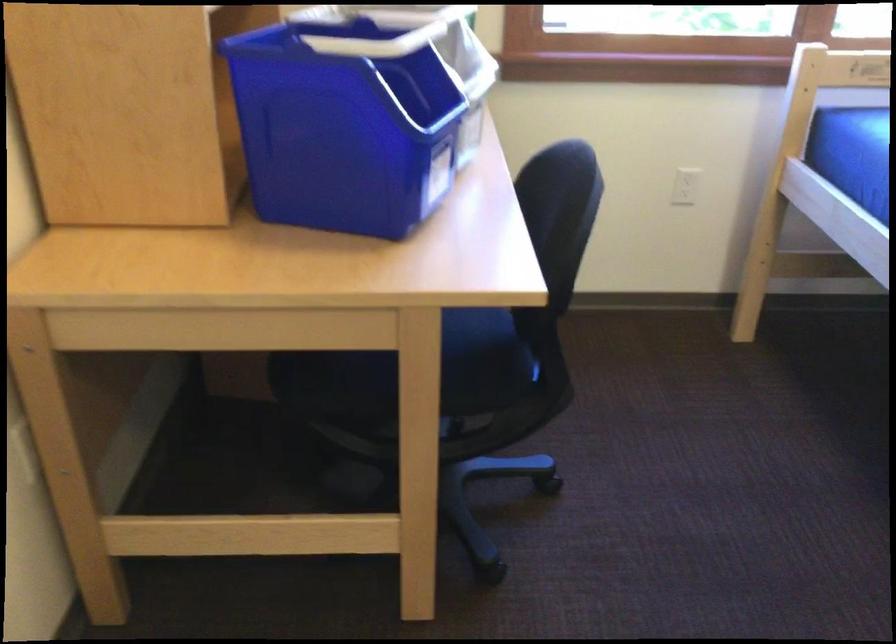
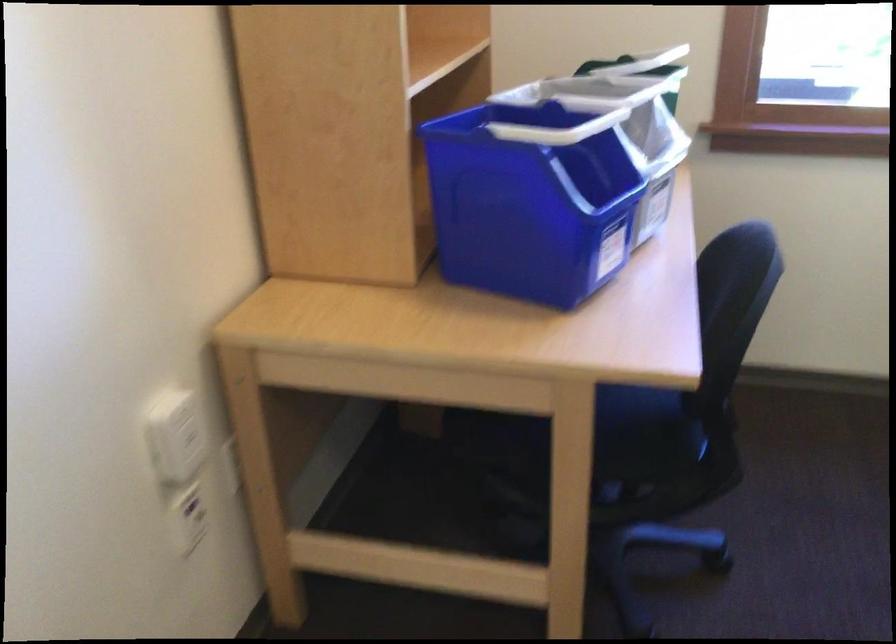
Question: The images are taken continuously from a first-person perspective. In which direction is your viewpoint rotating?

Choices:
 (A) Left
 (B) Right
 (C) Up
 (D) Down

Answer: (A)